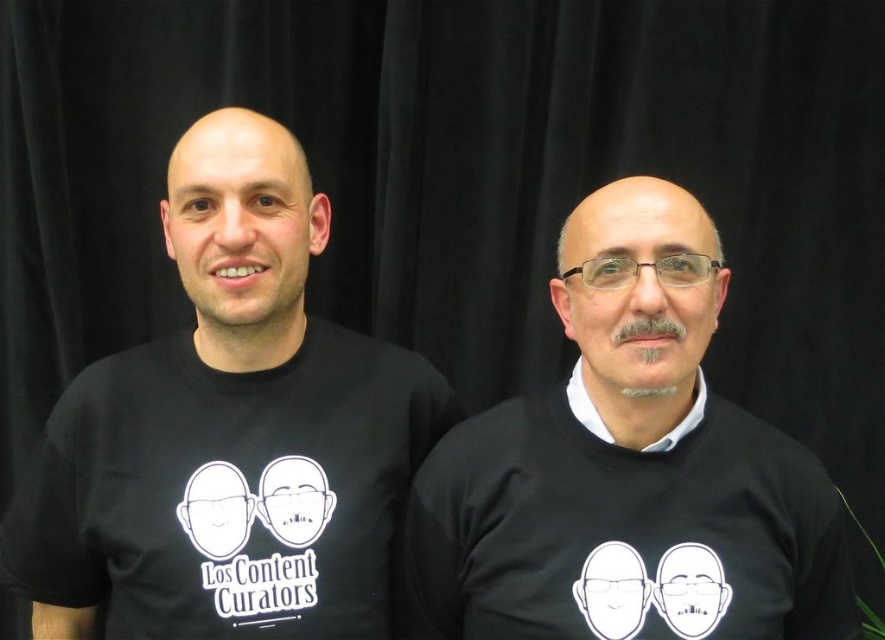
Question: In this image, where is black matte t-shirt at left located relative to black matte t-shirt at center?

Choices:
 (A) left
 (B) right

Answer: (A)

Question: Does black matte t-shirt at left have a smaller size compared to black matte t-shirt at center?

Choices:
 (A) yes
 (B) no

Answer: (B)

Question: Which object is the farthest from the black matte t-shirt at center?

Choices:
 (A) black matte shirt at center
 (B) black matte t-shirt at left

Answer: (B)

Question: Estimate the real-world distances between objects in this image. Which object is closer to the black matte t-shirt at left?

Choices:
 (A) black matte shirt at center
 (B) black matte t-shirt at center

Answer: (B)

Question: Observing the image, what is the correct spatial positioning of black matte t-shirt at left in reference to black matte t-shirt at center?

Choices:
 (A) left
 (B) right

Answer: (A)

Question: Which of the following is the closest to the observer?

Choices:
 (A) black matte t-shirt at left
 (B) black matte t-shirt at center
 (C) black matte shirt at center

Answer: (B)